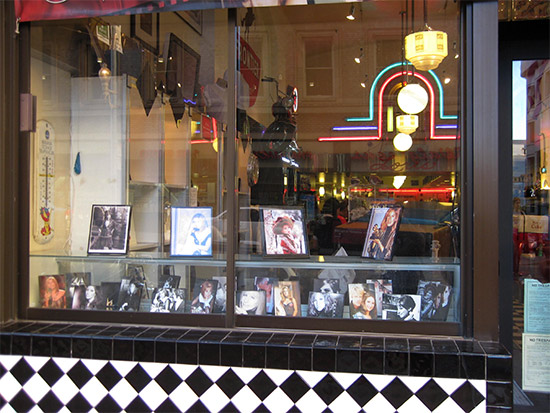
At what (x,y) coordinates should I click in order to perform the action: click on round lamp. Please return your answer as a coordinate pair (x, y). Looking at the image, I should click on (409, 107).